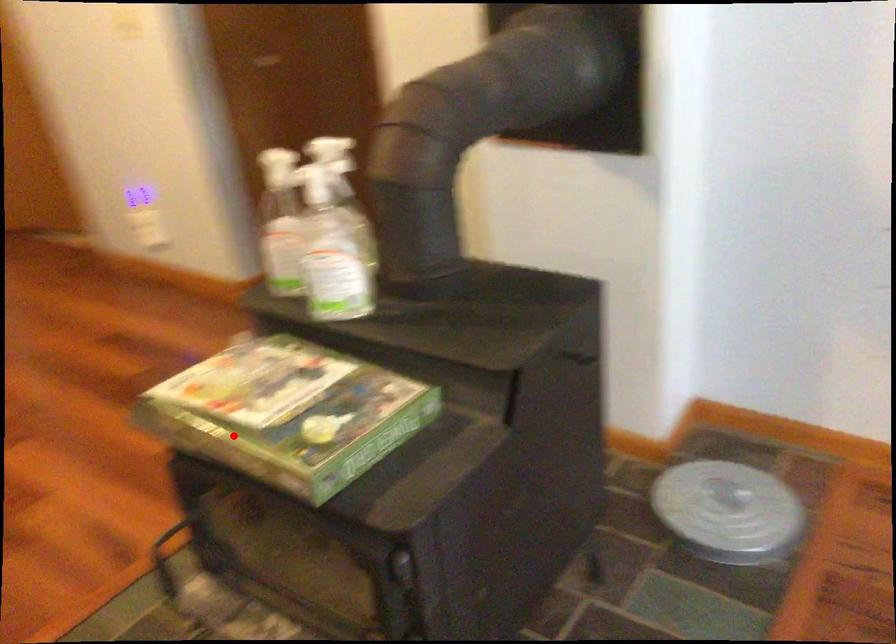
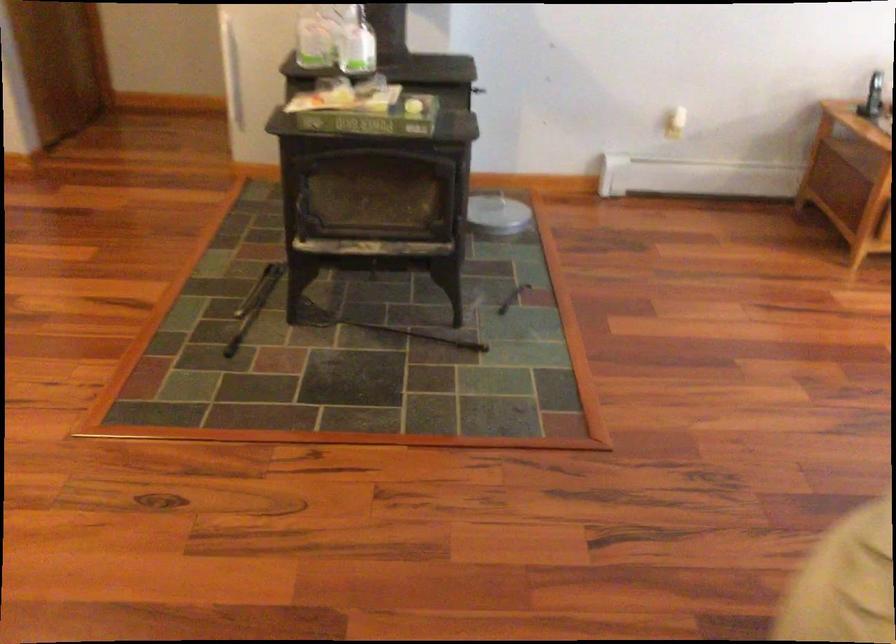
Where in the second image is the point corresponding to the highlighted location from the first image?

(366, 116)